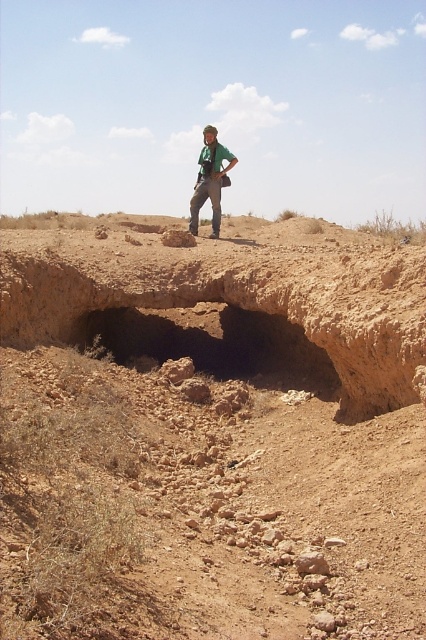
You are navigating a desert landscape and need to locate the dusty brown dirt field at center. Based on the coordinates provided, in which direction should you move from your current position at the cave entrance to reach it?

The dusty brown dirt field at center is located at coordinates point [210,433]. Since the cave entrance is at the edge of the cave, you should move towards the center of the image to reach the field.

Consider the image. You are a photographer planning to take a picture of the dusty brown dirt field at center and the green fabric shirt at center. Which object should you focus on first if you want to capture both in sharp focus?

The dusty brown dirt field at center is located below green fabric shirt at center, so you should focus on the green fabric shirt at center first to ensure both are in focus since it is closer to the camera.

You are standing in a desert landscape and want to take a photo of the dusty soil cave at center. If your camera has a maximum focus range of 12 meters, will it be able to capture the cave clearly?

The dusty soil cave at center is 11.98 meters from viewer, so yes, the camera can focus on it clearly since the distance is within the 12 meter limit.